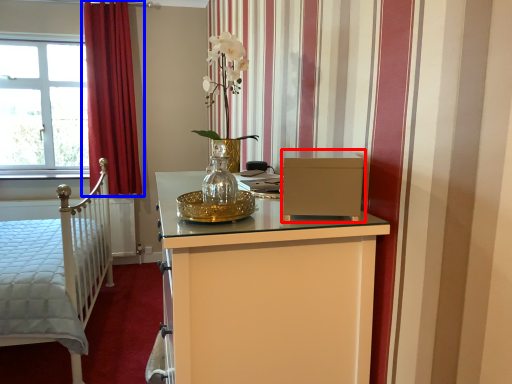
Question: Which object appears farthest to the camera in this image, file cabinet (highlighted by a red box) or curtain (highlighted by a blue box)?

Choices:
 (A) file cabinet
 (B) curtain

Answer: (B)